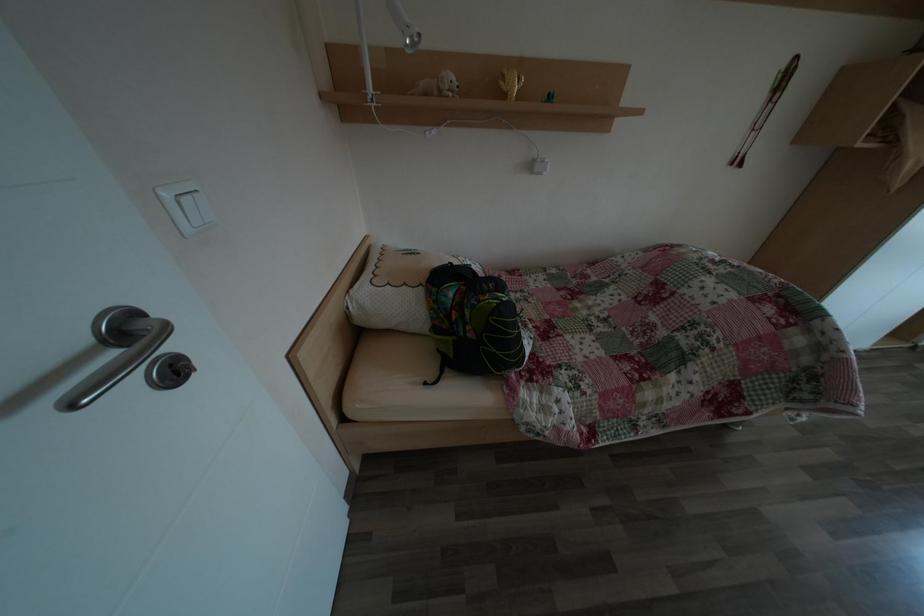
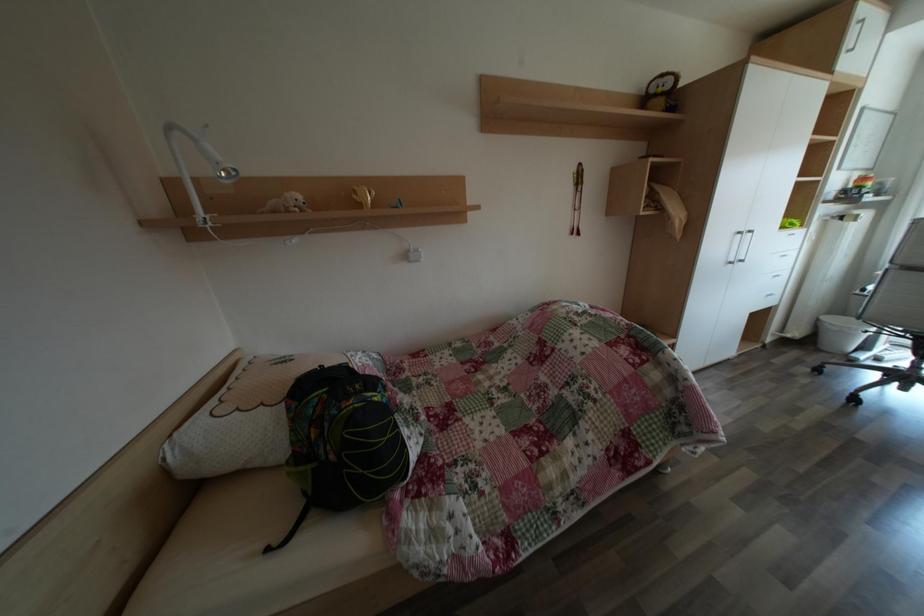
Question: Which direction would the cameraman need to move to produce the second image? Reply with the corresponding letter.

Choices:
 (A) Left
 (B) Right
 (C) Forward
 (D) Backward

Answer: (B)